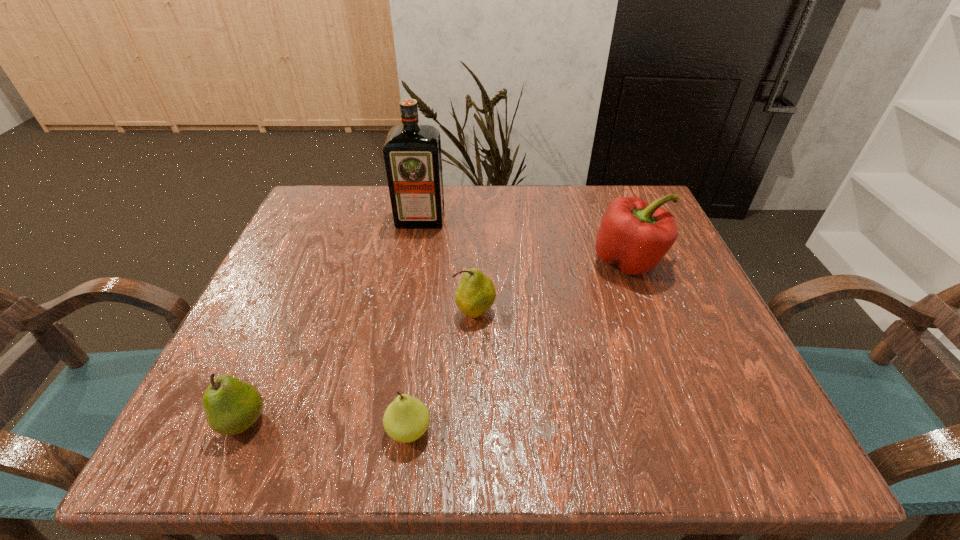
Where is `free space that satisfies the following two spatial constraints: 1. on the front label of the farthest object; 2. on the left side of the second tallest object`? This screenshot has width=960, height=540. free space that satisfies the following two spatial constraints: 1. on the front label of the farthest object; 2. on the left side of the second tallest object is located at coordinates (413, 261).

This screenshot has width=960, height=540. Identify the location of free space that satisfies the following two spatial constraints: 1. on the front label of the tallest object; 2. on the right side of the second tallest object. (413, 261).